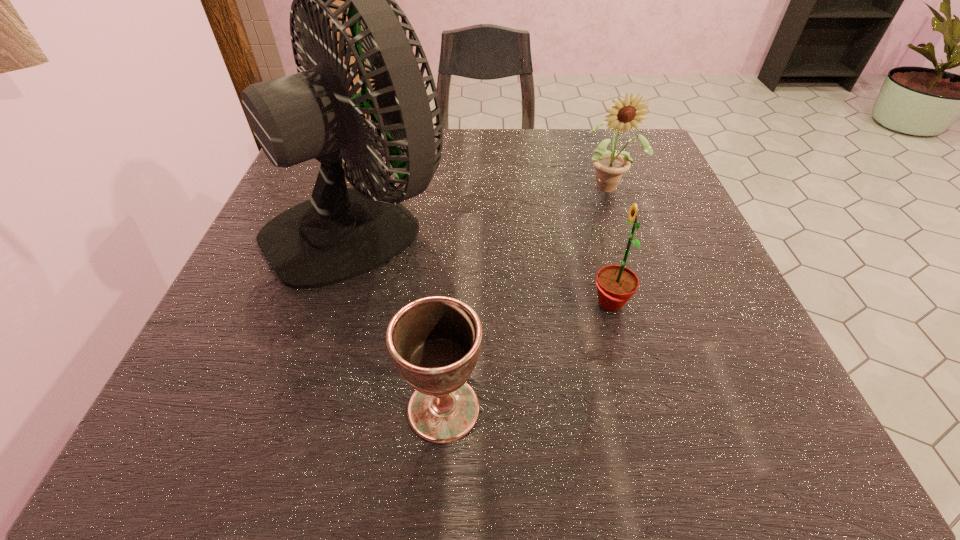
Where is `free space that satisfies the following two spatial constraints: 1. on the front-facing side of the farther sunflower; 2. on the face of the nearer sunflower`? The width and height of the screenshot is (960, 540). free space that satisfies the following two spatial constraints: 1. on the front-facing side of the farther sunflower; 2. on the face of the nearer sunflower is located at coordinates (651, 303).